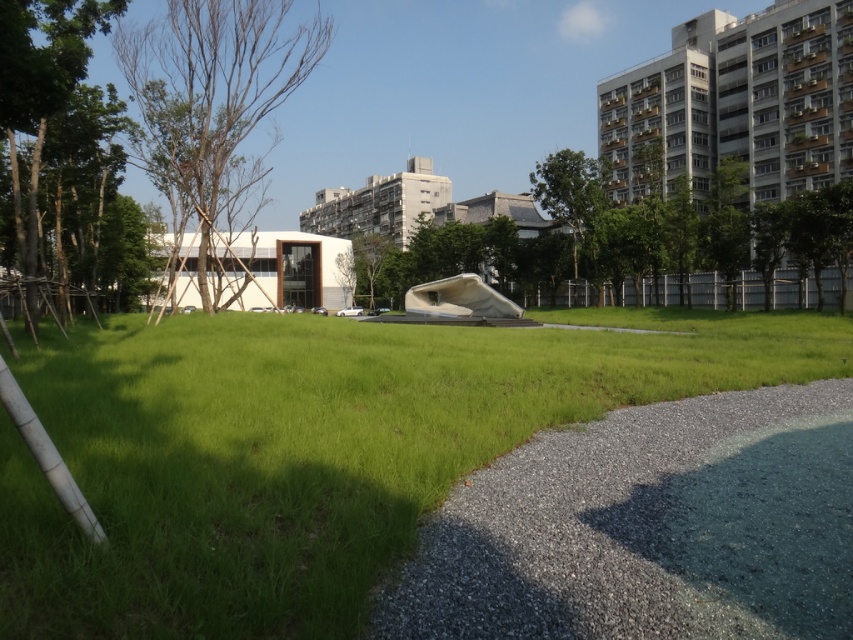
You are standing in the urban park and want to take a photo of both point (747,432) and point (549,200) in the image. Which point should you focus on first to ensure both are in focus?

You should focus on point (549,200) first because it is farther from the camera than point (747,432). By focusing on the farther point, the depth of field will likely include the closer point as well.